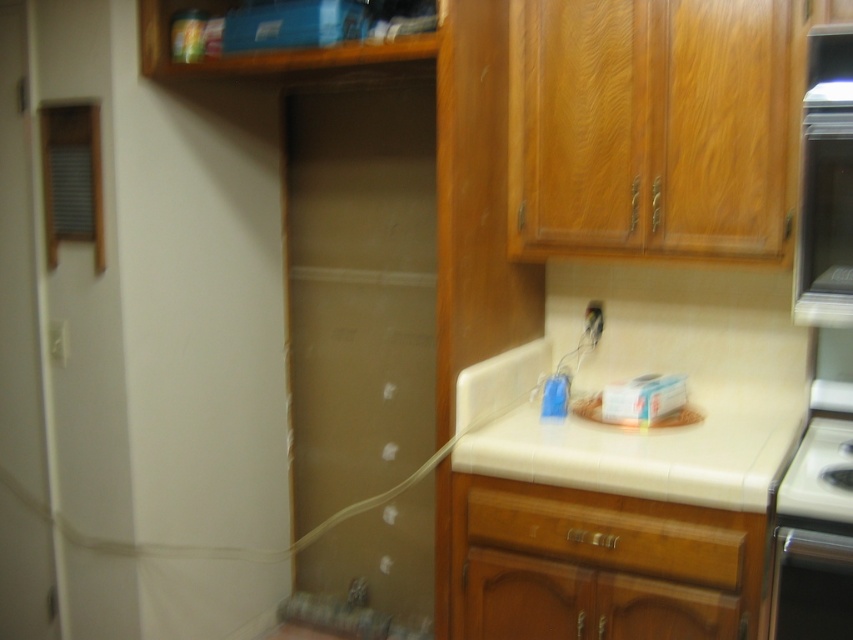
Question: Does wooden drawer at center have a greater width compared to satin black oven at lower right?

Choices:
 (A) no
 (B) yes

Answer: (B)

Question: Can you confirm if wooden drawer at center is bigger than satin black oven at lower right?

Choices:
 (A) yes
 (B) no

Answer: (A)

Question: Which point is farther to the camera?

Choices:
 (A) black glossy stove at lower right
 (B) beige tile countertop at center
 (C) wooden drawer at center
 (D) satin black oven at lower right

Answer: (C)

Question: Estimate the real-world distances between objects in this image. Which object is closer to the beige tile countertop at center?

Choices:
 (A) black glossy stove at lower right
 (B) satin black oven at lower right

Answer: (A)

Question: Is beige tile countertop at center positioned behind satin black oven at lower right?

Choices:
 (A) yes
 (B) no

Answer: (A)

Question: Which point is farther to the camera?

Choices:
 (A) satin black oven at lower right
 (B) black glossy stove at lower right
 (C) beige tile countertop at center

Answer: (C)